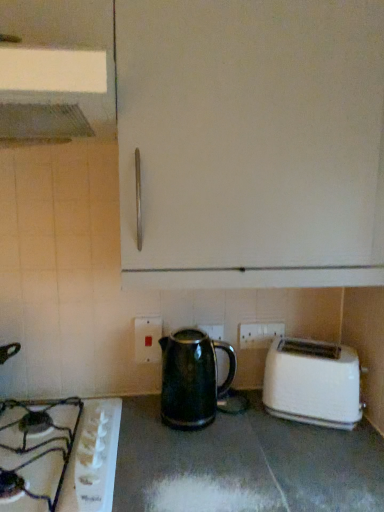
Identify the location of free point above black glossy kettle at center (from a real-world perspective). This screenshot has height=512, width=384. (191, 450).